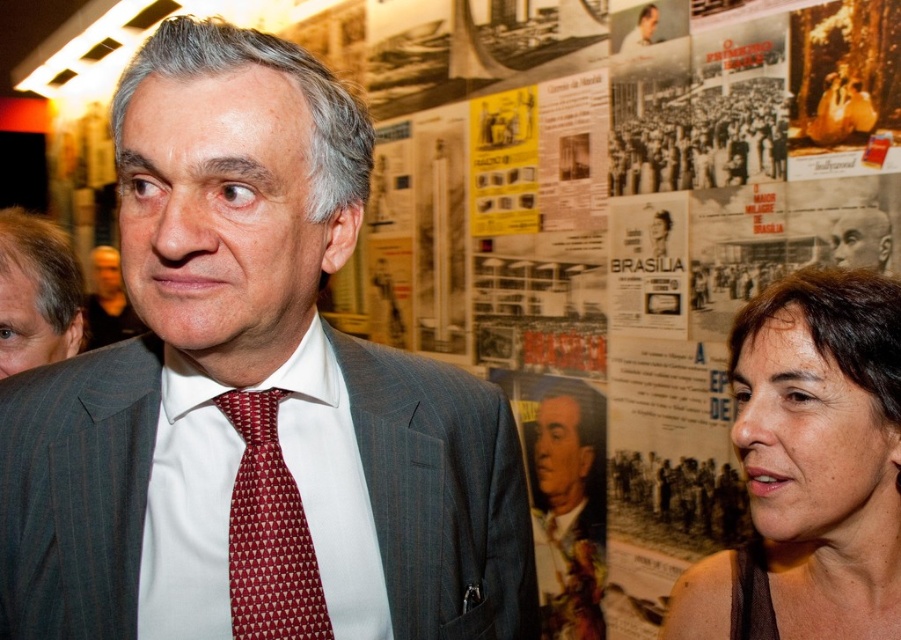
Question: Which point is farther to the camera?

Choices:
 (A) (651, 38)
 (B) (140, 51)
 (C) (531, 472)
 (D) (43, 257)

Answer: (C)

Question: Can you confirm if brown fabric at right is positioned to the right of red textured tie at center?

Choices:
 (A) no
 (B) yes

Answer: (B)

Question: Can you confirm if red textured tie at center is wider than matte red tie at center?

Choices:
 (A) yes
 (B) no

Answer: (B)

Question: Among these objects, which one is farthest from the camera?

Choices:
 (A) red textured tie at center
 (B) smooth gray suit at center

Answer: (B)

Question: Does red textured tie at center appear over smooth white shirt at upper center?

Choices:
 (A) no
 (B) yes

Answer: (A)

Question: Which object is the closest to the smooth dark suit at center?

Choices:
 (A) red textured tie at center
 (B) matte red tie at center

Answer: (A)